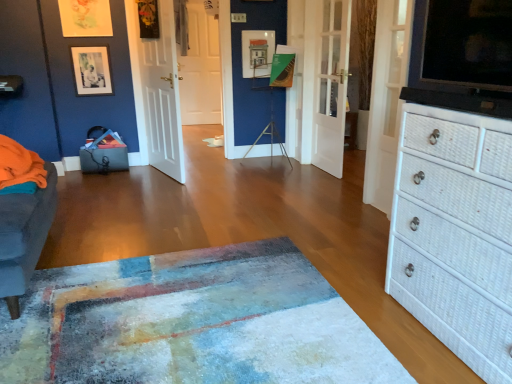
Where is `vacant space in front of white wooden door at left, which appears as the third door when viewed from the back`? The width and height of the screenshot is (512, 384). vacant space in front of white wooden door at left, which appears as the third door when viewed from the back is located at coordinates (146, 192).